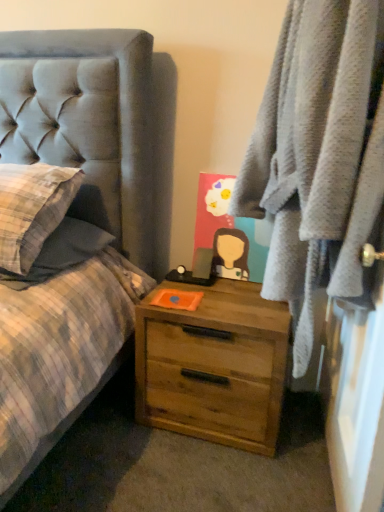
Find the location of a particular element. free point above wooden chest of drawers at lower right (from a real-world perspective) is located at coordinates (226, 295).